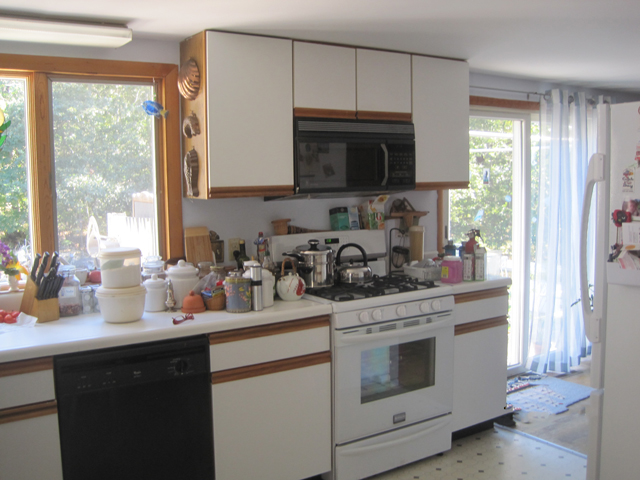
You are a GUI agent. You are given a task and a screenshot of the screen. Output one action in this format:
    pyautogui.click(x=<x>, y=<y>)
    Task: Click on the ceiling
    The height and width of the screenshot is (480, 640).
    Given the screenshot: What is the action you would take?
    pyautogui.click(x=424, y=24)